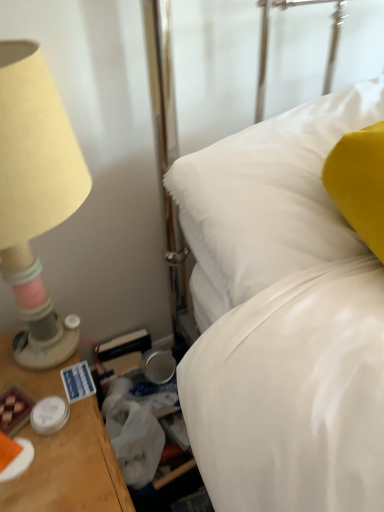
Question: Is point (79, 185) closer or farther from the camera than point (357, 332)?

Choices:
 (A) farther
 (B) closer

Answer: (A)

Question: From a real-world perspective, is beige fabric lampshade at left above or below white satin bed at center?

Choices:
 (A) above
 (B) below

Answer: (B)

Question: Considering the positions of beige fabric lampshade at left and white satin bed at center in the image, is beige fabric lampshade at left taller or shorter than white satin bed at center?

Choices:
 (A) tall
 (B) short

Answer: (A)

Question: Does point (350, 498) appear closer or farther from the camera than point (29, 168)?

Choices:
 (A) farther
 (B) closer

Answer: (B)

Question: Looking at their shapes, would you say white satin bed at center is wider or thinner than beige fabric lampshade at left?

Choices:
 (A) wide
 (B) thin

Answer: (A)

Question: From a real-world perspective, is white satin bed at center positioned above or below beige fabric lampshade at left?

Choices:
 (A) above
 (B) below

Answer: (A)

Question: Relative to beige fabric lampshade at left, is white satin bed at center in front or behind?

Choices:
 (A) front
 (B) behind

Answer: (B)